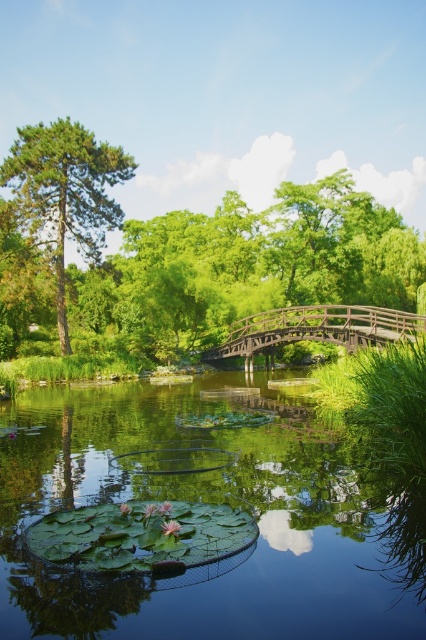
Which is in front, point (17, 436) or point (245, 371)?

Point (17, 436)

Is point (327, 572) less distant than point (339, 321)?

Yes.

The width and height of the screenshot is (426, 640). Find the location of `green leafy water at center`. green leafy water at center is located at coordinates (201, 500).

Can you confirm if green matte tree at left is thinner than green textured pine tree at upper left?

No, green matte tree at left is not thinner than green textured pine tree at upper left.

Is point (92, 326) farther from camera compared to point (92, 195)?

That is True.

What are the coordinates of `green matte tree at left` in the screenshot? It's located at (180, 253).

Does point (81, 240) come closer to viewer compared to point (284, 344)?

That is True.

You are a GUI agent. You are given a task and a screenshot of the screen. Output one action in this format:
    pyautogui.click(x=<x>, y=<y>)
    Task: Click on the green textured pine tree at upper left
    The width and height of the screenshot is (426, 640).
    Given the screenshot: What is the action you would take?
    pyautogui.click(x=65, y=193)

At what (x,y) coordinates should I click in order to perform the action: click on green textured pine tree at upper left. Please return your answer as a coordinate pair (x, y). Looking at the image, I should click on pyautogui.click(x=65, y=193).